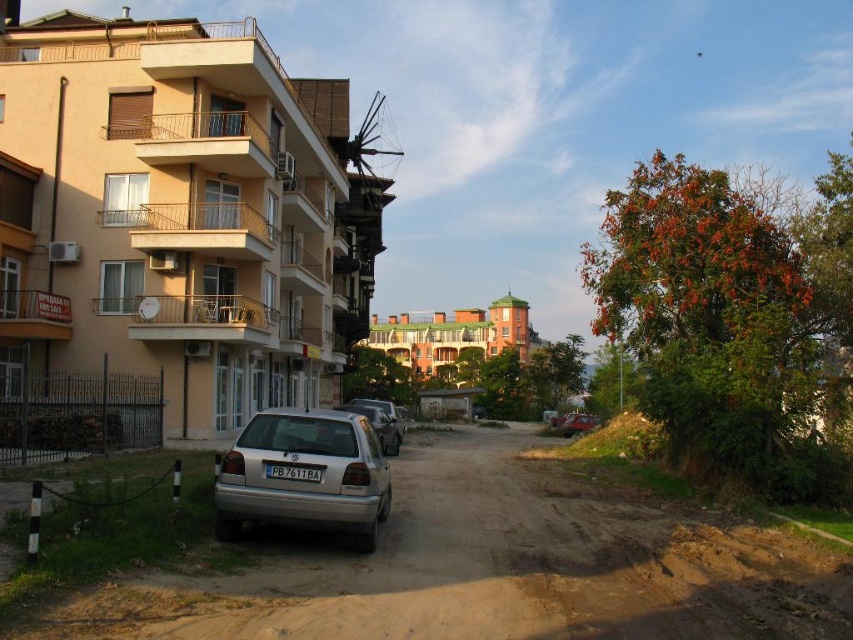
You are standing on the street looking at the scene. Which object is nearer to you, the brown dirt track at lower center or the black plastic license plate at center?

The brown dirt track at lower center is closer to the viewer than the black plastic license plate at center.

You are a pedestrian standing on the street and want to cross to the other side. There is a silver metallic car at center and a black plastic license plate at center in your way. Which object is closer to you that you need to avoid first?

The silver metallic car at center is closer to you than the black plastic license plate at center, so you should avoid the silver metallic car at center first.